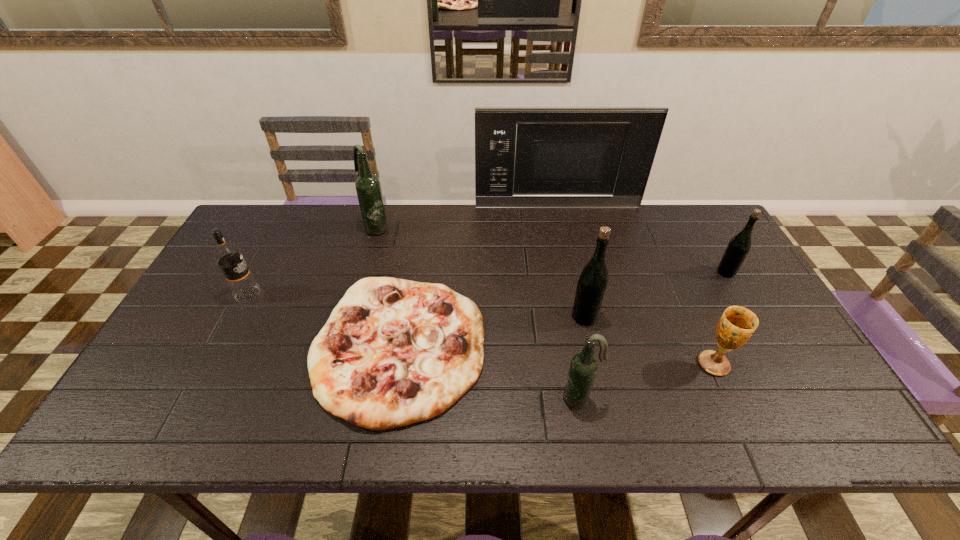
Identify the location of microwave oven. (552, 157).

Where is `dark microwave oven`? This screenshot has width=960, height=540. dark microwave oven is located at coordinates (552, 157).

Locate an element on the screen. This screenshot has height=540, width=960. the leftmost beer bottle is located at coordinates (368, 188).

Identify the location of the second farthest object. (368, 188).

Locate an element on the screen. This screenshot has height=540, width=960. the bigger green beer bottle is located at coordinates (592, 283).

Locate an element on the screen. This screenshot has width=960, height=540. the second nearest beer bottle is located at coordinates (592, 283).

Image resolution: width=960 pixels, height=540 pixels. In order to click on vodka in this screenshot , I will do `click(228, 256)`.

The width and height of the screenshot is (960, 540). I want to click on the third farthest object, so point(739,246).

This screenshot has height=540, width=960. What are the coordinates of `the rightmost beer bottle` in the screenshot? It's located at (739, 246).

The image size is (960, 540). What are the coordinates of `the nearer dark beer bottle` in the screenshot? It's located at (583, 367).